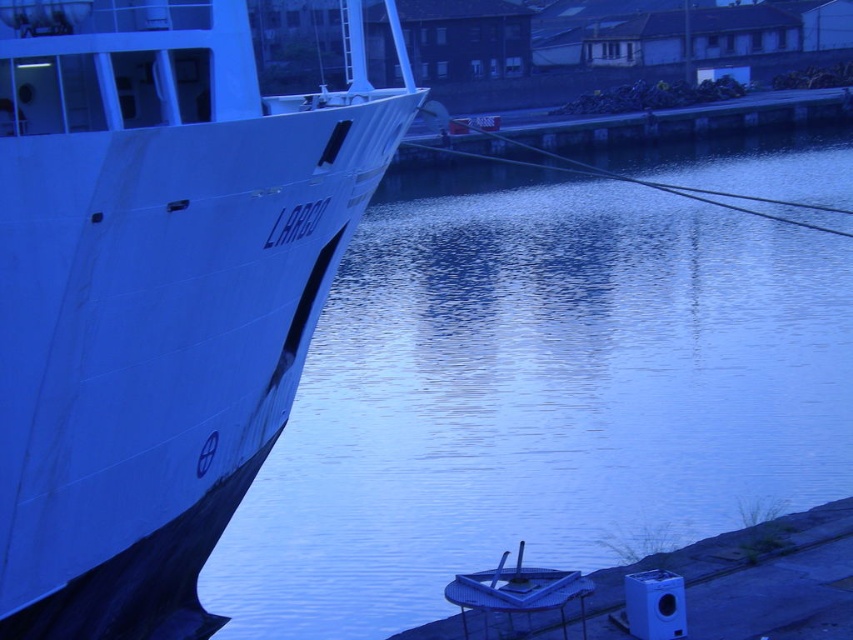
Is point (729, 280) in front of point (123, 333)?

That is False.

You are a GUI agent. You are given a task and a screenshot of the screen. Output one action in this format:
    pyautogui.click(x=<x>, y=<y>)
    Task: Click on the glossy water at center
    This screenshot has width=853, height=640.
    Given the screenshot: What is the action you would take?
    pyautogui.click(x=537, y=396)

Locate an element on the screen. The width and height of the screenshot is (853, 640). glossy water at center is located at coordinates (537, 396).

What are the coordinates of `glossy water at center` in the screenshot? It's located at (537, 396).